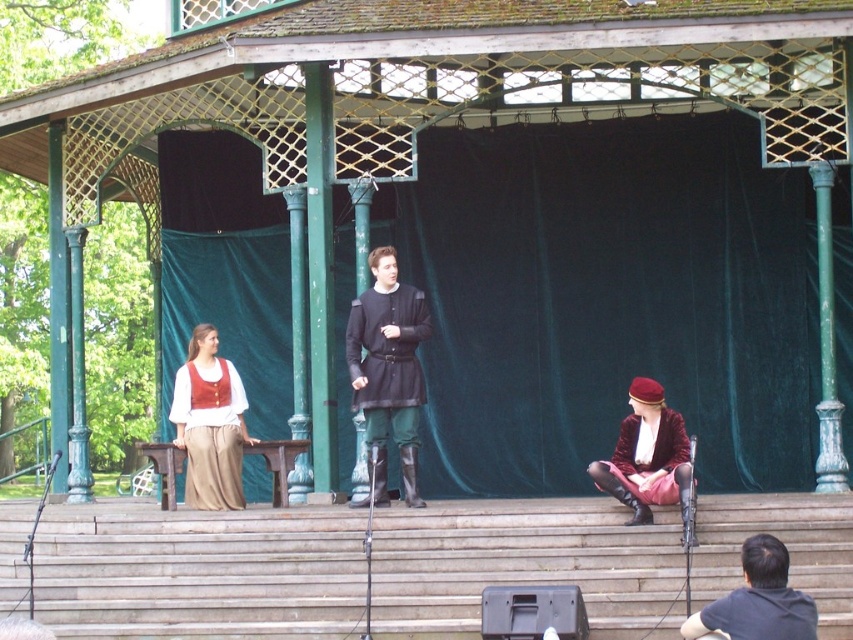
Question: Which of the following is the closest to the observer?

Choices:
 (A) (376, 291)
 (B) (514, 554)

Answer: (B)

Question: Which of the following is the closest to the observer?

Choices:
 (A) velvet maroon coat at lower right
 (B) matte red vest at center
 (C) dark gray shirt at lower right
 (D) matte black tunic at center

Answer: (C)

Question: Does matte red vest at center come in front of velvet maroon coat at lower right?

Choices:
 (A) no
 (B) yes

Answer: (A)

Question: From the image, what is the correct spatial relationship of matte red vest at center in relation to velvet maroon coat at lower right?

Choices:
 (A) below
 (B) above

Answer: (B)

Question: Can you confirm if matte red vest at center is smaller than velvet maroon coat at lower right?

Choices:
 (A) no
 (B) yes

Answer: (A)

Question: Which object is the closest to the wooden stairs at center?

Choices:
 (A) matte black tunic at center
 (B) velvet maroon coat at lower right
 (C) matte red vest at center

Answer: (B)